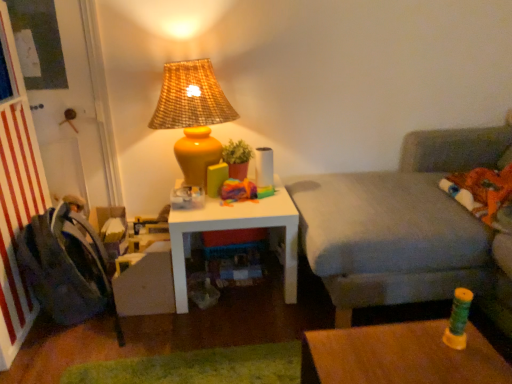
Question: Would you say matte yellow vase at upper center contains white matte table at center?

Choices:
 (A) no
 (B) yes

Answer: (A)

Question: Is white matte table at center at the back of matte yellow vase at upper center?

Choices:
 (A) no
 (B) yes

Answer: (A)

Question: Considering the relative sizes of matte yellow vase at upper center and white matte table at center in the image provided, is matte yellow vase at upper center wider than white matte table at center?

Choices:
 (A) no
 (B) yes

Answer: (A)

Question: Is matte yellow vase at upper center smaller than white matte table at center?

Choices:
 (A) no
 (B) yes

Answer: (B)

Question: Is matte yellow vase at upper center thinner than white matte table at center?

Choices:
 (A) yes
 (B) no

Answer: (A)

Question: In terms of height, does gray fabric couch at right look taller or shorter compared to matte yellow vase at upper center?

Choices:
 (A) tall
 (B) short

Answer: (A)

Question: Considering the positions of gray fabric couch at right and matte yellow vase at upper center in the image, is gray fabric couch at right wider or thinner than matte yellow vase at upper center?

Choices:
 (A) thin
 (B) wide

Answer: (B)

Question: Is gray fabric couch at right inside the boundaries of matte yellow vase at upper center, or outside?

Choices:
 (A) outside
 (B) inside

Answer: (A)

Question: From a real-world perspective, is gray fabric couch at right above or below matte yellow vase at upper center?

Choices:
 (A) below
 (B) above

Answer: (A)

Question: Relative to white matte table at center, is gray fabric couch at right in front or behind?

Choices:
 (A) front
 (B) behind

Answer: (A)

Question: From the image's perspective, is gray fabric couch at right located above or below white matte table at center?

Choices:
 (A) below
 (B) above

Answer: (B)

Question: From their relative heights in the image, would you say gray fabric couch at right is taller or shorter than white matte table at center?

Choices:
 (A) short
 (B) tall

Answer: (B)

Question: Considering the positions of gray fabric couch at right and white matte table at center in the image, is gray fabric couch at right bigger or smaller than white matte table at center?

Choices:
 (A) small
 (B) big

Answer: (B)

Question: In terms of height, does gray fabric couch at right look taller or shorter compared to dark gray fabric swivel chair at left?

Choices:
 (A) tall
 (B) short

Answer: (A)

Question: Relative to dark gray fabric swivel chair at left, is gray fabric couch at right in front or behind?

Choices:
 (A) front
 (B) behind

Answer: (A)